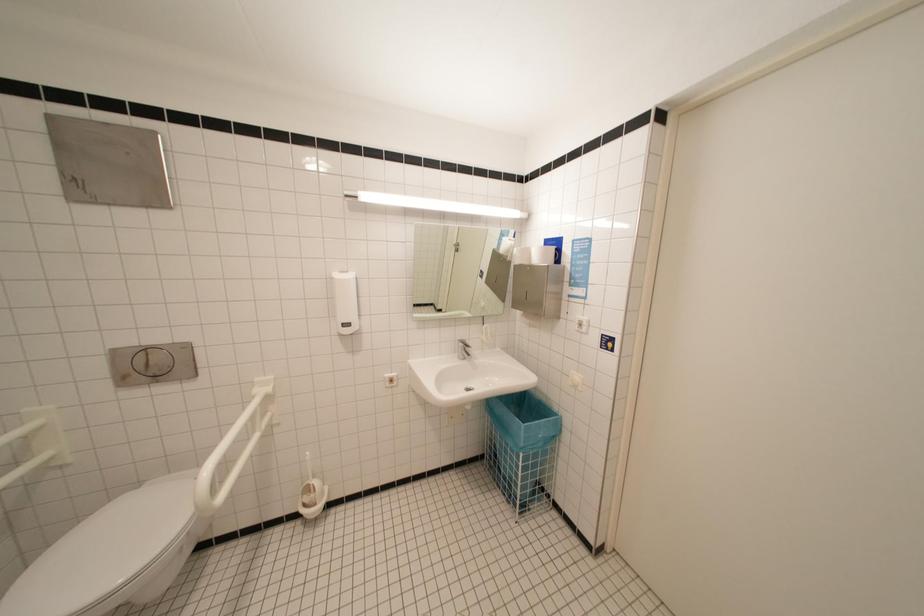
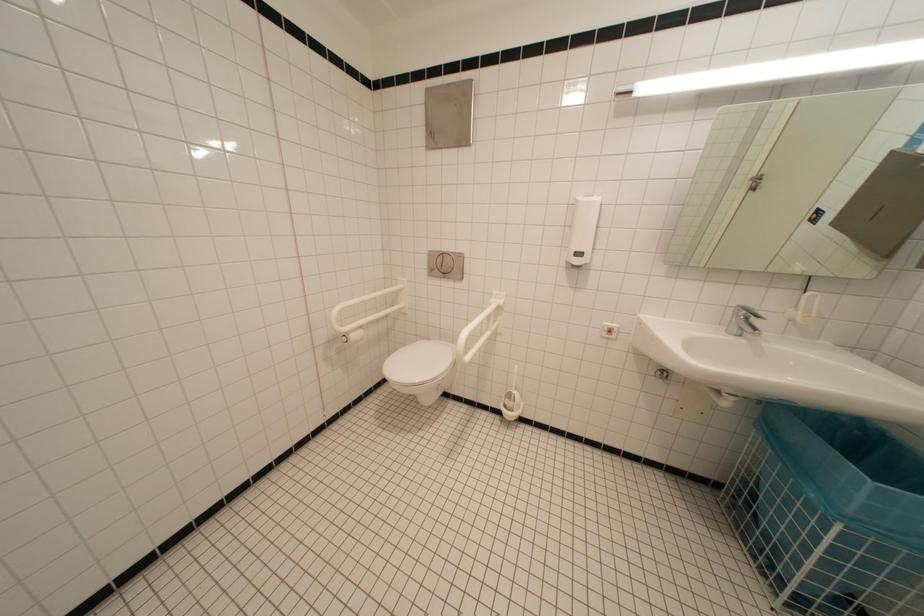
Question: The images are taken continuously from a first-person perspective. In which direction is your viewpoint rotating?

Choices:
 (A) Left
 (B) Right
 (C) Up
 (D) Down

Answer: (A)